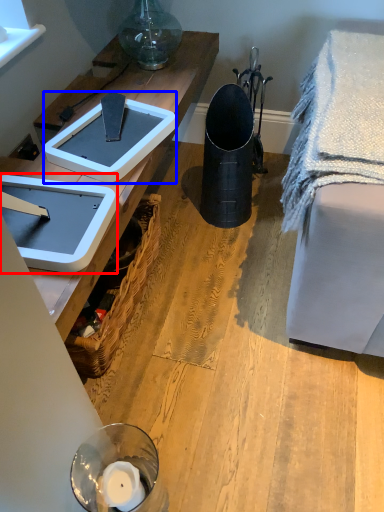
Question: Which of the following is the farthest to the observer, weight scale (highlighted by a red box) or weight scale (highlighted by a blue box)?

Choices:
 (A) weight scale
 (B) weight scale

Answer: (B)